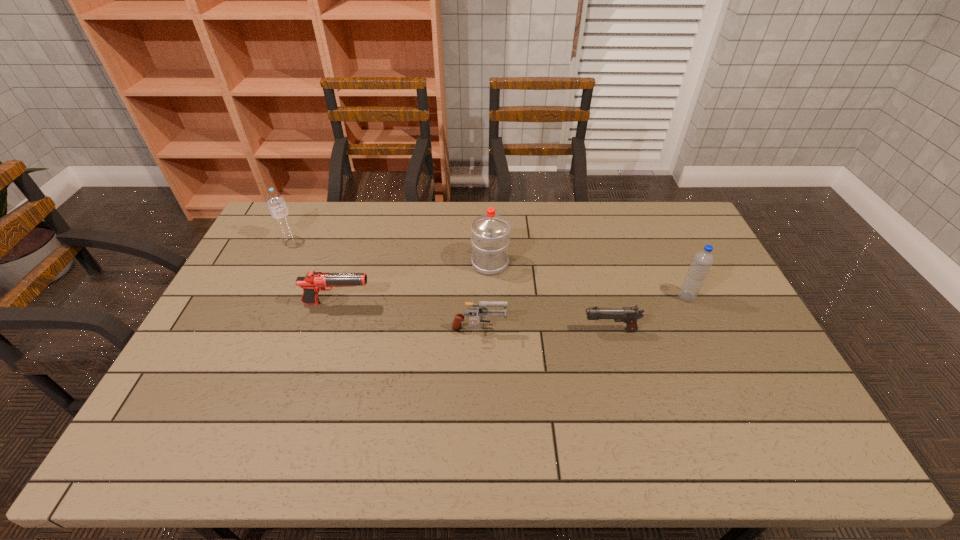
This screenshot has width=960, height=540. I want to click on object located in the far edge section of the desktop, so click(x=276, y=203).

Locate an element on the screen. object positioned at the left edge is located at coordinates (276, 203).

The image size is (960, 540). I want to click on object present at the right edge, so click(x=702, y=261).

Image resolution: width=960 pixels, height=540 pixels. Find the location of `object that is positioned at the far left corner`. object that is positioned at the far left corner is located at coordinates (276, 203).

Image resolution: width=960 pixels, height=540 pixels. In the image, there is a desktop. Find the location of `vacant region at the far edge`. vacant region at the far edge is located at coordinates [526, 224].

This screenshot has height=540, width=960. In order to click on free space at the near edge of the desktop in this screenshot , I will do `click(231, 439)`.

At what (x,y) coordinates should I click in order to perform the action: click on vacant region at the left edge of the desktop. Please return your answer as a coordinate pair (x, y). This screenshot has width=960, height=540. Looking at the image, I should click on (x=180, y=421).

This screenshot has height=540, width=960. I want to click on blank space at the right edge of the desktop, so click(705, 332).

At what (x,y) coordinates should I click in order to perform the action: click on free space at the far right corner of the desktop. Please return your answer as a coordinate pair (x, y). This screenshot has width=960, height=540. Looking at the image, I should click on (670, 217).

Image resolution: width=960 pixels, height=540 pixels. What are the coordinates of `vacant region at the near right corner of the desktop` in the screenshot? It's located at (770, 437).